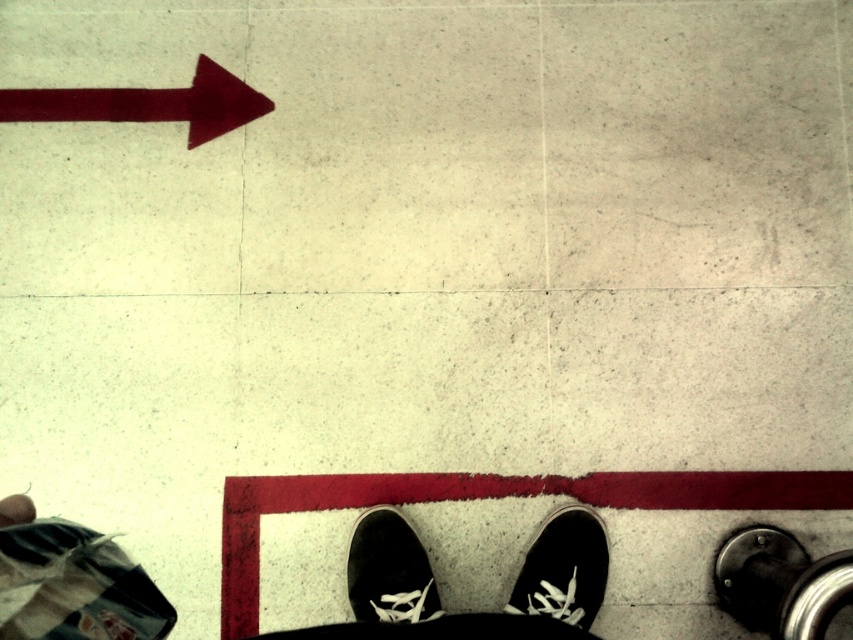
Looking at this image, is black canvas shoe at lower center thinner than black suede shoe at lower center?

Incorrect, black canvas shoe at lower center's width is not less than black suede shoe at lower center's.

The width and height of the screenshot is (853, 640). What are the coordinates of `black canvas shoe at lower center` in the screenshot? It's located at (563, 568).

Does matte red arrow at upper left come in front of black suede shoe at lower center?

No, it is behind black suede shoe at lower center.

At what (x,y) coordinates should I click in order to perform the action: click on matte red arrow at upper left. Please return your answer as a coordinate pair (x, y). Looking at the image, I should click on (148, 104).

Is matte red arrow at upper left positioned at the back of black canvas shoe at lower center?

Yes, it is.

Which is above, matte red arrow at upper left or black canvas shoe at lower center?

matte red arrow at upper left is higher up.

Who is more distant from viewer, (61,90) or (543,524)?

Point (61,90)

What are the coordinates of `matte red arrow at upper left` in the screenshot? It's located at (148, 104).